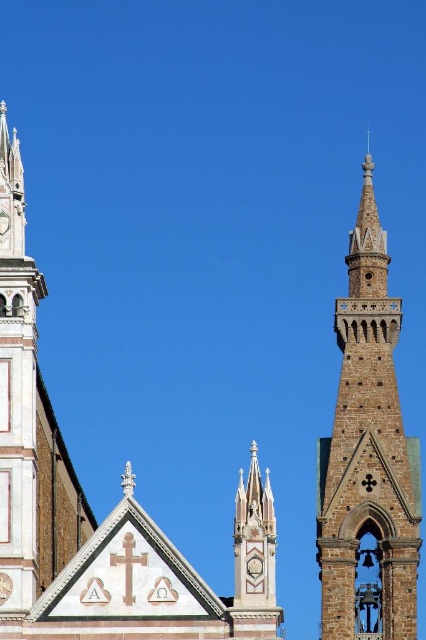
Question: Based on their relative distances, which object is farther from the brown stone spire at upper right?

Choices:
 (A) white stone church at upper center
 (B) white marble tower at left

Answer: (B)

Question: Can you confirm if white stone church at upper center is positioned above brown stone spire at upper right?

Choices:
 (A) no
 (B) yes

Answer: (B)

Question: Does brown stone spire at upper right appear under white marble tower at left?

Choices:
 (A) no
 (B) yes

Answer: (B)

Question: Which point is closer to the camera?

Choices:
 (A) white stone church at upper center
 (B) white marble tower at left

Answer: (A)

Question: Is brown stone spire at upper right closer to the viewer compared to white marble tower at left?

Choices:
 (A) no
 (B) yes

Answer: (A)

Question: Which is nearer to the brown stone spire at upper right?

Choices:
 (A) white marble tower at left
 (B) white stone church at upper center

Answer: (B)